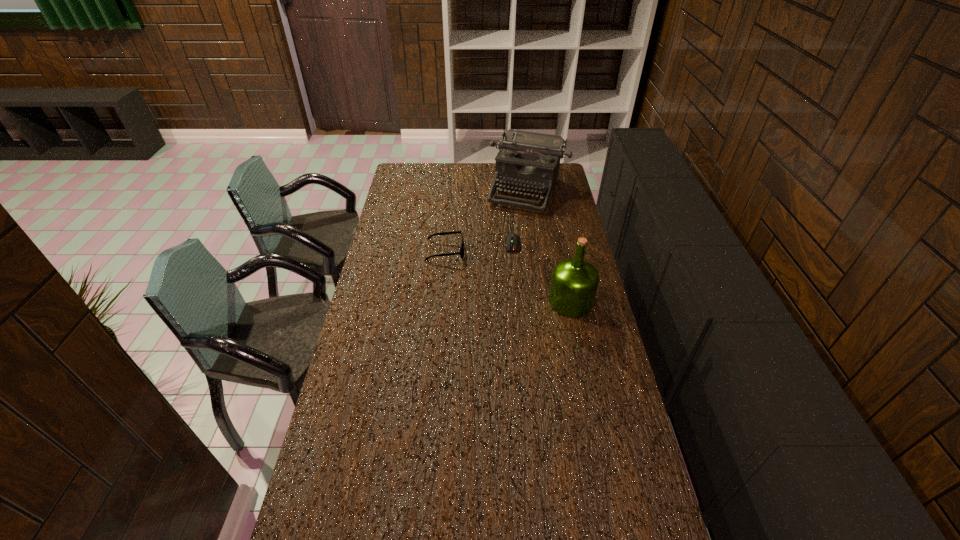
The height and width of the screenshot is (540, 960). Identify the location of free space on the desktop that is between the leftmost object and the olive oil and is positioned on the typing side of the second tallest object. (492, 270).

Locate an element on the screen. This screenshot has height=540, width=960. free space on the desktop that is between the sunglasses and the tallest object and is positioned on the button of the shortest object is located at coordinates (511, 278).